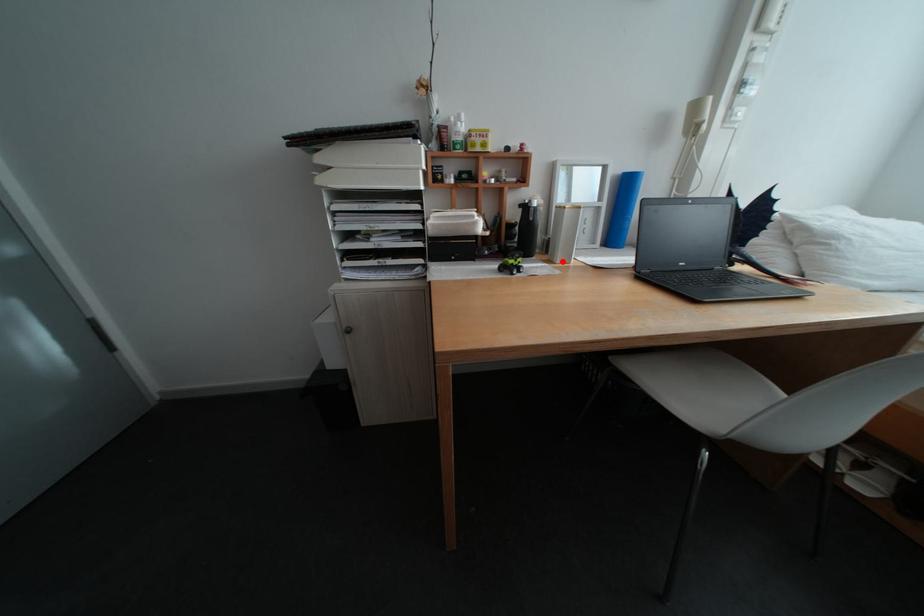
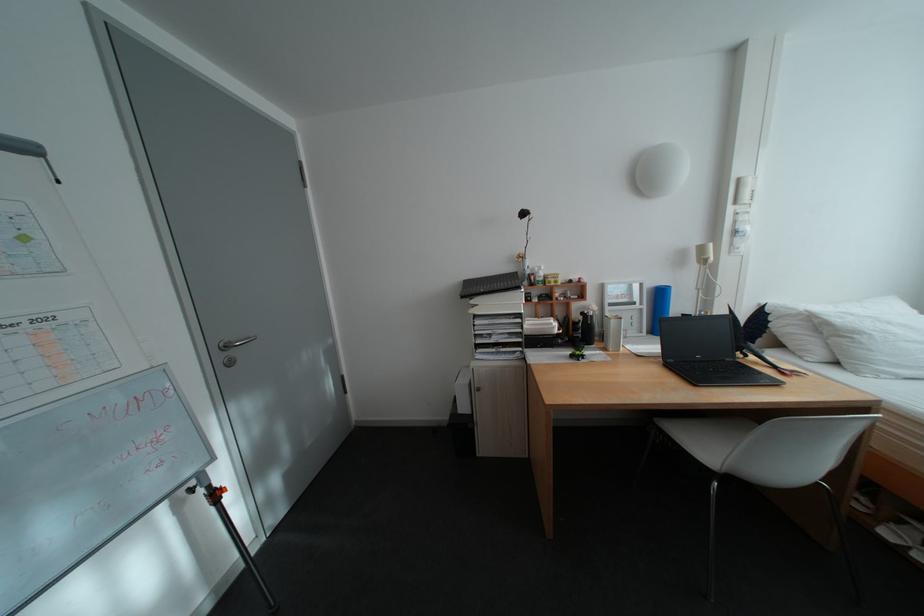
Find the pixel in the second image that matches the highlighted location in the first image.

(617, 350)